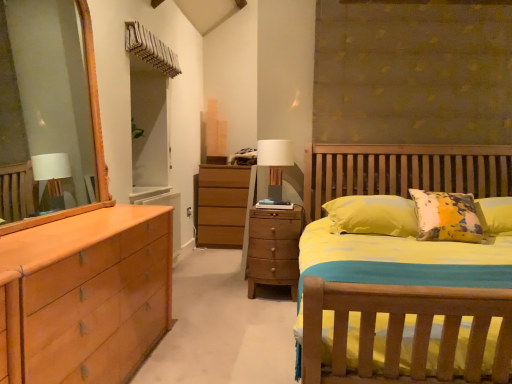
Question: Is matte brown chest of drawers at center aimed at white fabric-covered table lamp at center?

Choices:
 (A) no
 (B) yes

Answer: (A)

Question: Considering the relative sizes of matte brown chest of drawers at center and white fabric-covered table lamp at center in the image provided, is matte brown chest of drawers at center wider than white fabric-covered table lamp at center?

Choices:
 (A) yes
 (B) no

Answer: (A)

Question: From a real-world perspective, is matte brown chest of drawers at center physically below white fabric-covered table lamp at center?

Choices:
 (A) no
 (B) yes

Answer: (B)

Question: Would you say white fabric-covered table lamp at center is part of matte brown chest of drawers at center's contents?

Choices:
 (A) yes
 (B) no

Answer: (B)

Question: Is matte brown chest of drawers at center not close to white fabric-covered table lamp at center?

Choices:
 (A) no
 (B) yes

Answer: (A)

Question: Is matte brown chest of drawers at center with white fabric-covered table lamp at center?

Choices:
 (A) yes
 (B) no

Answer: (B)

Question: Is white fabric-covered table lamp at center outside of matte brown chest of drawers at center?

Choices:
 (A) no
 (B) yes

Answer: (B)

Question: Can you confirm if white fabric-covered table lamp at center is smaller than matte brown chest of drawers at center?

Choices:
 (A) no
 (B) yes

Answer: (B)

Question: From the image's perspective, does white fabric-covered table lamp at center appear lower than matte brown chest of drawers at center?

Choices:
 (A) yes
 (B) no

Answer: (B)

Question: Is white fabric-covered table lamp at center taller than matte brown chest of drawers at center?

Choices:
 (A) no
 (B) yes

Answer: (A)

Question: Considering the relative sizes of white fabric-covered table lamp at center and matte brown chest of drawers at center in the image provided, is white fabric-covered table lamp at center wider than matte brown chest of drawers at center?

Choices:
 (A) no
 (B) yes

Answer: (A)

Question: Is white fabric-covered table lamp at center oriented towards matte brown chest of drawers at center?

Choices:
 (A) no
 (B) yes

Answer: (A)

Question: Relative to matte brown chest of drawers at center, is white fabric-covered table lamp at center in front or behind?

Choices:
 (A) front
 (B) behind

Answer: (B)